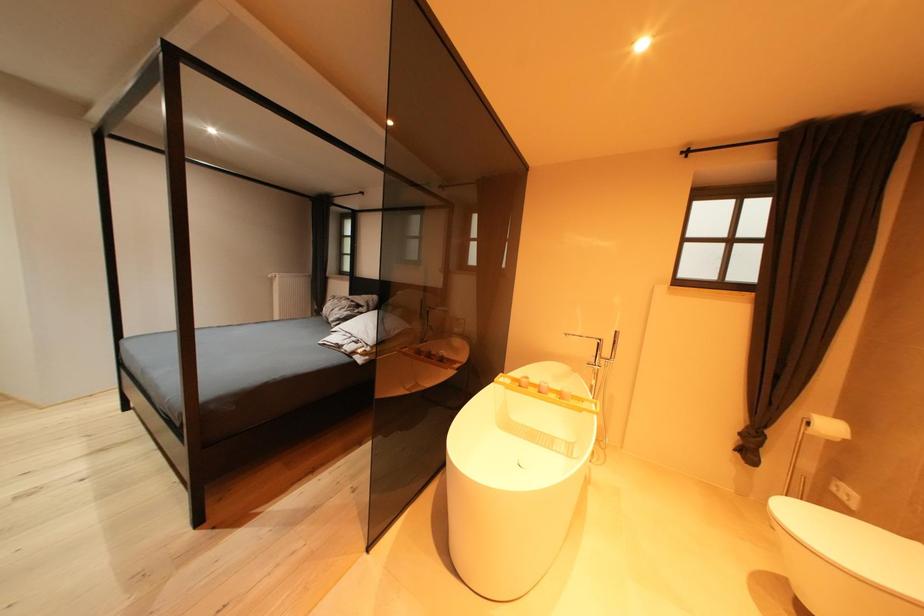
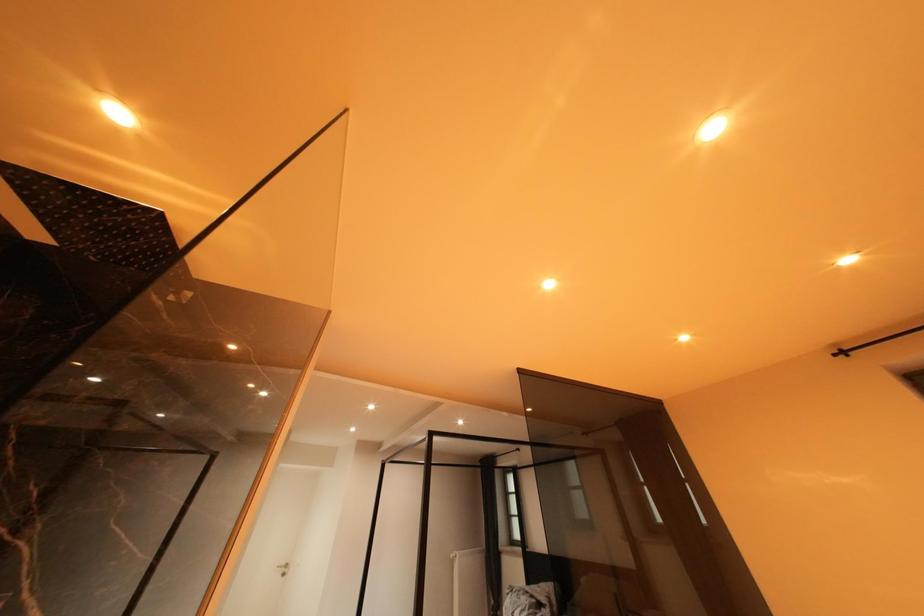
The first image is from the beginning of the video and the second image is from the end. How did the camera likely rotate when shooting the video?

The camera rotated toward left-up.